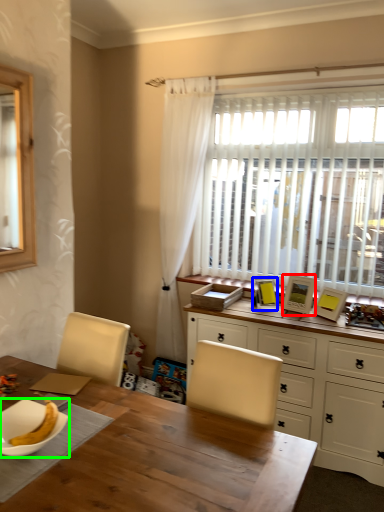
Question: Which object is the farthest from picture frame (highlighted by a red box)? Choose among these: picture frame (highlighted by a blue box) or tableware (highlighted by a green box).

Choices:
 (A) picture frame
 (B) tableware

Answer: (B)